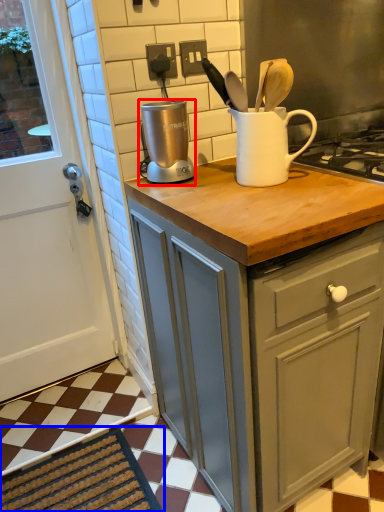
Question: Which object appears closest to the camera in this image, kitchen appliance (highlighted by a red box) or doormat (highlighted by a blue box)?

Choices:
 (A) kitchen appliance
 (B) doormat

Answer: (A)